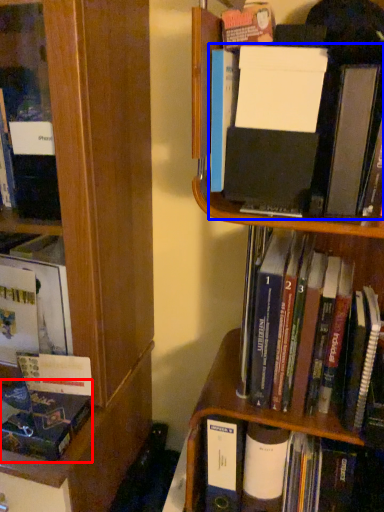
Question: Which of the following is the farthest to the observer, book (highlighted by a red box) or book (highlighted by a blue box)?

Choices:
 (A) book
 (B) book

Answer: (A)